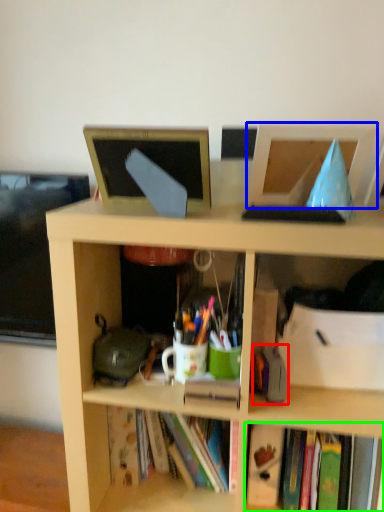
Question: Considering the real-world distances, which object is farthest from stationery (highlighted by a red box)? computer monitor (highlighted by a blue box) or book (highlighted by a green box)?

Choices:
 (A) computer monitor
 (B) book

Answer: (A)